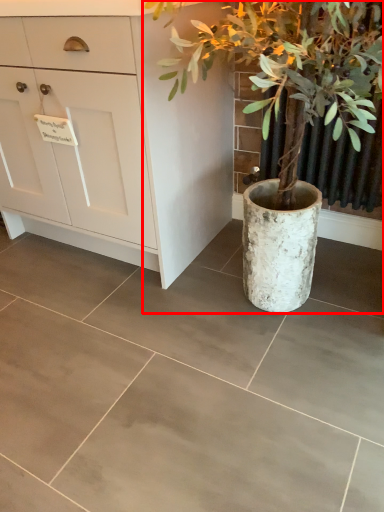
Question: Observing the image, what is the correct spatial positioning of houseplant (annotated by the red box) in reference to chest of drawers?

Choices:
 (A) left
 (B) right

Answer: (B)